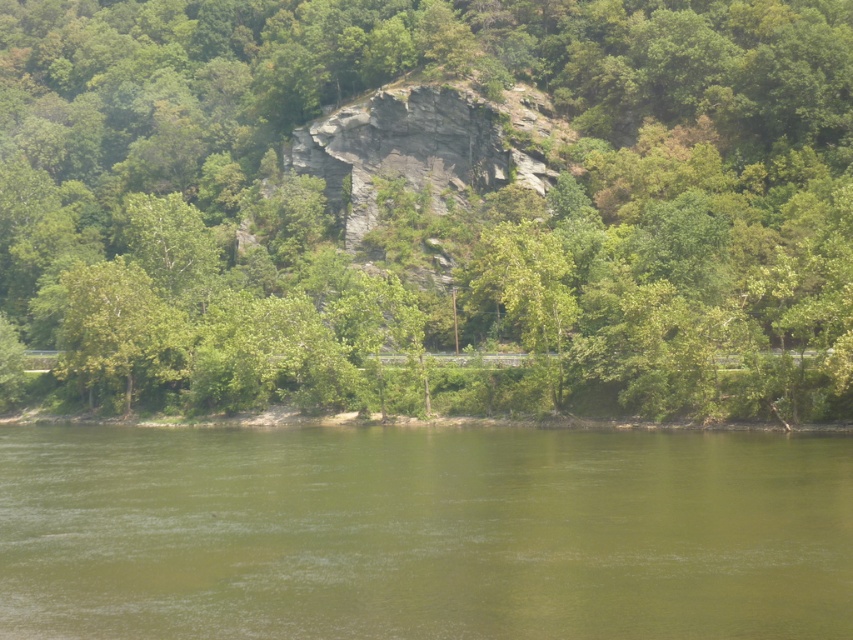
Which is behind, point (328, 19) or point (409, 563)?

The point (328, 19) is behind.

Which is more to the left, green leafy tree at center or green water at lower center?

green leafy tree at center is more to the left.

The height and width of the screenshot is (640, 853). Find the location of `green leafy tree at center`. green leafy tree at center is located at coordinates (432, 202).